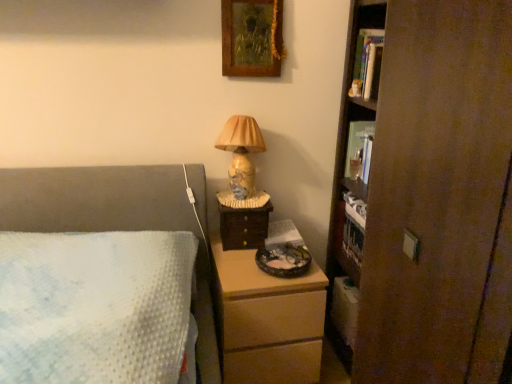
Find the location of a particular element. The width and height of the screenshot is (512, 384). vacant space in front of wooden drawer at right is located at coordinates (234, 263).